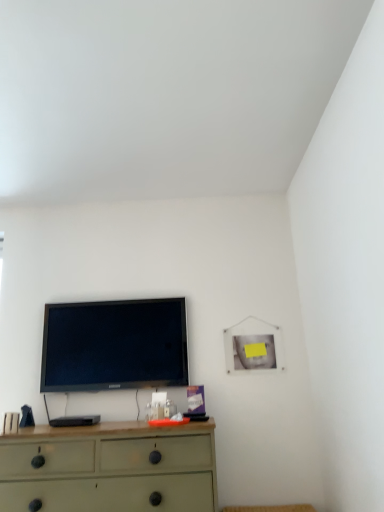
This screenshot has height=512, width=384. Describe the element at coordinates (114, 345) in the screenshot. I see `black glossy tv at upper center` at that location.

You are a GUI agent. You are given a task and a screenshot of the screen. Output one action in this format:
    pyautogui.click(x=<x>, y=<y>)
    Task: Click on the black glossy tv at upper center
    Image resolution: width=384 pixels, height=512 pixels.
    Given the screenshot: What is the action you would take?
    pyautogui.click(x=114, y=345)

What do you see at coordinates (110, 468) in the screenshot? Image resolution: width=384 pixels, height=512 pixels. I see `matte green dresser at lower center` at bounding box center [110, 468].

Image resolution: width=384 pixels, height=512 pixels. Identify the location of matte green dresser at lower center. (110, 468).

In order to click on black glossy tv at upper center in this screenshot , I will do `click(114, 345)`.

Is matte green dresser at lower center at the right side of black glossy tv at upper center?

Yes, matte green dresser at lower center is to the right of black glossy tv at upper center.

Between matte green dresser at lower center and black glossy tv at upper center, which one is positioned behind?

black glossy tv at upper center is further from the camera.

Which is behind, point (183, 459) or point (92, 359)?

The point (92, 359) is more distant.

Looking at this image, from the image's perspective, is matte green dresser at lower center located beneath black glossy tv at upper center?

Yes, from the image's perspective, matte green dresser at lower center is below black glossy tv at upper center.

From a real-world perspective, is matte green dresser at lower center located higher than black glossy tv at upper center?

No, from a real-world perspective, matte green dresser at lower center is not above black glossy tv at upper center.

Is matte green dresser at lower center wider or thinner than black glossy tv at upper center?

Clearly, matte green dresser at lower center has more width compared to black glossy tv at upper center.

From their relative heights in the image, would you say matte green dresser at lower center is taller or shorter than black glossy tv at upper center?

In the image, matte green dresser at lower center appears to be shorter than black glossy tv at upper center.

Can you confirm if matte green dresser at lower center is smaller than black glossy tv at upper center?

No.

Is matte green dresser at lower center situated inside black glossy tv at upper center or outside?

The correct answer is: outside.

Is matte green dresser at lower center in contact with black glossy tv at upper center?

No, matte green dresser at lower center is not with black glossy tv at upper center.

Does matte green dresser at lower center turn towards black glossy tv at upper center?

No.

Can you tell me how much matte green dresser at lower center and black glossy tv at upper center differ in facing direction?

The facing directions of matte green dresser at lower center and black glossy tv at upper center are 0.446 degrees apart.

What are the coordinates of `the chest of drawers below the black glossy tv at upper center (from the image's perspective)` in the screenshot? It's located at (110, 468).

Does black glossy tv at upper center appear on the left side of matte green dresser at lower center?

Correct, you'll find black glossy tv at upper center to the left of matte green dresser at lower center.

Considering the positions of objects black glossy tv at upper center and matte green dresser at lower center in the image provided, who is in front, black glossy tv at upper center or matte green dresser at lower center?

matte green dresser at lower center is closer to the camera.

Is point (158, 336) behind point (2, 476)?

Yes, it is.

From the image's perspective, which is above, black glossy tv at upper center or matte green dresser at lower center?

black glossy tv at upper center.

From a real-world perspective, is black glossy tv at upper center above or below matte green dresser at lower center?

black glossy tv at upper center is situated higher than matte green dresser at lower center in the real world.

Does black glossy tv at upper center have a lesser width compared to matte green dresser at lower center?

Yes, black glossy tv at upper center is thinner than matte green dresser at lower center.

Which of these two, black glossy tv at upper center or matte green dresser at lower center, stands taller?

black glossy tv at upper center is taller.

Considering the sizes of objects black glossy tv at upper center and matte green dresser at lower center in the image provided, who is smaller, black glossy tv at upper center or matte green dresser at lower center?

Smaller between the two is black glossy tv at upper center.

Is black glossy tv at upper center inside the boundaries of matte green dresser at lower center, or outside?

black glossy tv at upper center is located beyond the bounds of matte green dresser at lower center.

In the scene shown: Would you say black glossy tv at upper center is a long distance from matte green dresser at lower center?

No, there isn't a large distance between black glossy tv at upper center and matte green dresser at lower center.

Is black glossy tv at upper center turned away from matte green dresser at lower center?

black glossy tv at upper center does not have its back to matte green dresser at lower center.

What's the angular difference between black glossy tv at upper center and matte green dresser at lower center's facing directions?

They differ by 0.446 degrees in their facing directions.

In the image, there is a black glossy tv at upper center. At what (x,y) coordinates should I click in order to perform the action: click on the chest of drawers below it (from the image's perspective). Please return your answer as a coordinate pair (x, y). Looking at the image, I should click on (110, 468).

This screenshot has height=512, width=384. What are the coordinates of `television behind the matte green dresser at lower center` in the screenshot? It's located at (114, 345).

In order to click on chest of drawers in front of the black glossy tv at upper center in this screenshot , I will do `click(110, 468)`.